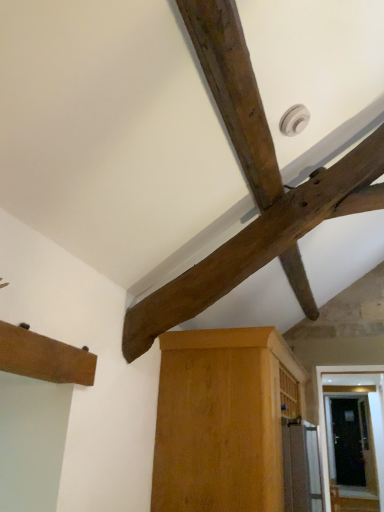
The image size is (384, 512). What are the coordinates of `brown wood cabinet at lower left, the 2th cabinetry from the right` in the screenshot? It's located at (44, 357).

What do you see at coordinates (251, 247) in the screenshot? I see `dark brown wood beam at upper center` at bounding box center [251, 247].

This screenshot has width=384, height=512. In order to click on brown wood cabinet at lower left, the first cabinetry in the front-to-back sequence in this screenshot , I will do `click(44, 357)`.

Does dark brown wood beam at upper center come behind brown wood cabinet at lower left, the first cabinetry viewed from the left?

That is True.

Could you tell me if dark brown wood beam at upper center is turned towards brown wood cabinet at lower left, the first cabinetry in the front-to-back sequence?

No, dark brown wood beam at upper center is not oriented towards brown wood cabinet at lower left, the first cabinetry in the front-to-back sequence.

How many degrees apart are the facing directions of dark brown wood beam at upper center and brown wood cabinet at lower left, the first cabinetry viewed from the left?

88.8 degrees.

Does dark brown wood beam at upper center touch brown wood cabinet at lower left, the 2th cabinetry ordered from the bottom?

No.

From a real-world perspective, between brown wood cabinet at lower left, the second cabinetry positioned from the back, and light brown wood cabinet at center, which ranks as the second cabinetry in front-to-back order, who is vertically lower?

In real-world perspective, light brown wood cabinet at center, which ranks as the second cabinetry in front-to-back order, is lower.

From their relative heights in the image, would you say brown wood cabinet at lower left, the second cabinetry positioned from the back, is taller or shorter than light brown wood cabinet at center, marked as the 1th cabinetry in a back-to-front arrangement?

Considering their sizes, brown wood cabinet at lower left, the second cabinetry positioned from the back, has less height than light brown wood cabinet at center, marked as the 1th cabinetry in a back-to-front arrangement.

Is brown wood cabinet at lower left, the second cabinetry positioned from the back, not near light brown wood cabinet at center, marked as the 1th cabinetry in a back-to-front arrangement?

No, brown wood cabinet at lower left, the second cabinetry positioned from the back, is not far away from light brown wood cabinet at center, marked as the 1th cabinetry in a back-to-front arrangement.

Is dark brown wood beam at upper center smaller than light brown wood cabinet at center, the second cabinetry from the left?

Yes.

Could you tell me if dark brown wood beam at upper center is turned towards light brown wood cabinet at center, which appears as the first cabinetry when viewed from the right?

Yes, dark brown wood beam at upper center is oriented towards light brown wood cabinet at center, which appears as the first cabinetry when viewed from the right.

Is light brown wood cabinet at center, which appears as the first cabinetry when viewed from the right, inside dark brown wood beam at upper center?

Definitely not — light brown wood cabinet at center, which appears as the first cabinetry when viewed from the right, is not inside dark brown wood beam at upper center.

Can you confirm if dark brown wood beam at upper center is thinner than light brown wood cabinet at center, marked as the 1th cabinetry in a back-to-front arrangement?

Indeed, dark brown wood beam at upper center has a lesser width compared to light brown wood cabinet at center, marked as the 1th cabinetry in a back-to-front arrangement.

Image resolution: width=384 pixels, height=512 pixels. What are the coordinates of `cabinetry lying on the left of dark brown wood beam at upper center` in the screenshot? It's located at (44, 357).

From the image's perspective, relative to dark brown wood beam at upper center, is brown wood cabinet at lower left, the 2th cabinetry ordered from the bottom, above or below?

Based on their image positions, brown wood cabinet at lower left, the 2th cabinetry ordered from the bottom, is located beneath dark brown wood beam at upper center.

Considering the sizes of objects brown wood cabinet at lower left, the first cabinetry from the top, and dark brown wood beam at upper center in the image provided, who is thinner, brown wood cabinet at lower left, the first cabinetry from the top, or dark brown wood beam at upper center?

With smaller width is brown wood cabinet at lower left, the first cabinetry from the top.

Which object is positioned more to the right, brown wood cabinet at lower left, the first cabinetry in the front-to-back sequence, or dark brown wood beam at upper center?

dark brown wood beam at upper center.

Is light brown wood cabinet at center, which ranks as the second cabinetry in front-to-back order, not near brown wood cabinet at lower left, the 2th cabinetry from the right?

Actually, light brown wood cabinet at center, which ranks as the second cabinetry in front-to-back order, and brown wood cabinet at lower left, the 2th cabinetry from the right, are a little close together.

From a real-world perspective, is light brown wood cabinet at center, positioned as the 2th cabinetry in top-to-bottom order, physically located above or below brown wood cabinet at lower left, the first cabinetry in the front-to-back sequence?

Clearly, from a real-world perspective, light brown wood cabinet at center, positioned as the 2th cabinetry in top-to-bottom order, is below brown wood cabinet at lower left, the first cabinetry in the front-to-back sequence.

Is light brown wood cabinet at center, positioned as the 2th cabinetry in top-to-bottom order, outside of brown wood cabinet at lower left, the first cabinetry from the top?

That's correct, light brown wood cabinet at center, positioned as the 2th cabinetry in top-to-bottom order, is outside of brown wood cabinet at lower left, the first cabinetry from the top.

Would you say light brown wood cabinet at center, which is the 1th cabinetry in bottom-to-top order, is to the left or to the right of brown wood cabinet at lower left, the first cabinetry viewed from the left, in the picture?

Based on their positions, light brown wood cabinet at center, which is the 1th cabinetry in bottom-to-top order, is located to the right of brown wood cabinet at lower left, the first cabinetry viewed from the left.

Between point (272, 355) and point (149, 339), which one is positioned behind?

The point (272, 355) is more distant.

Is dark brown wood beam at upper center surrounded by light brown wood cabinet at center, marked as the 1th cabinetry in a back-to-front arrangement?

No, light brown wood cabinet at center, marked as the 1th cabinetry in a back-to-front arrangement, does not contain dark brown wood beam at upper center.

Is light brown wood cabinet at center, which appears as the first cabinetry when viewed from the right, directly adjacent to dark brown wood beam at upper center?

No, light brown wood cabinet at center, which appears as the first cabinetry when viewed from the right, is not with dark brown wood beam at upper center.

Is light brown wood cabinet at center, which is the 1th cabinetry in bottom-to-top order, shorter than dark brown wood beam at upper center?

Yes.

At what (x,y) coordinates should I click in order to perform the action: click on beam that appears above the brown wood cabinet at lower left, the second cabinetry positioned from the back (from the image's perspective). Please return your answer as a coordinate pair (x, y). Looking at the image, I should click on (251, 247).

Image resolution: width=384 pixels, height=512 pixels. There is a light brown wood cabinet at center, the second cabinetry from the left. Identify the location of cabinetry above it (from a real-world perspective). (44, 357).

Consider the image. Looking at the image, which one is located further to light brown wood cabinet at center, positioned as the 2th cabinetry in top-to-bottom order, dark brown wood beam at upper center or brown wood cabinet at lower left, the first cabinetry viewed from the left?

Among the two, brown wood cabinet at lower left, the first cabinetry viewed from the left, is located further to light brown wood cabinet at center, positioned as the 2th cabinetry in top-to-bottom order.

Considering their positions, is dark brown wood beam at upper center positioned further to brown wood cabinet at lower left, the first cabinetry in the front-to-back sequence, than light brown wood cabinet at center, which ranks as the second cabinetry in front-to-back order?

The object further to brown wood cabinet at lower left, the first cabinetry in the front-to-back sequence, is light brown wood cabinet at center, which ranks as the second cabinetry in front-to-back order.

Looking at the image, which one is located closer to light brown wood cabinet at center, the second cabinetry from the left, brown wood cabinet at lower left, the 2th cabinetry ordered from the bottom, or dark brown wood beam at upper center?

dark brown wood beam at upper center lies closer to light brown wood cabinet at center, the second cabinetry from the left, than the other object.

Which object lies nearer to the anchor point dark brown wood beam at upper center, brown wood cabinet at lower left, the 2th cabinetry ordered from the bottom, or light brown wood cabinet at center, which is the 1th cabinetry in bottom-to-top order?

light brown wood cabinet at center, which is the 1th cabinetry in bottom-to-top order.

Based on their spatial positions, is light brown wood cabinet at center, which appears as the first cabinetry when viewed from the right, or brown wood cabinet at lower left, the 2th cabinetry ordered from the bottom, further from dark brown wood beam at upper center?

Among the two, brown wood cabinet at lower left, the 2th cabinetry ordered from the bottom, is located further to dark brown wood beam at upper center.

Based on their spatial positions, is light brown wood cabinet at center, which ranks as the second cabinetry in front-to-back order, or dark brown wood beam at upper center closer to brown wood cabinet at lower left, the first cabinetry viewed from the left?

dark brown wood beam at upper center.

Find the location of a particular element. cabinetry between dark brown wood beam at upper center and light brown wood cabinet at center, which is the 1th cabinetry in bottom-to-top order, in the up-down direction is located at coordinates (44, 357).